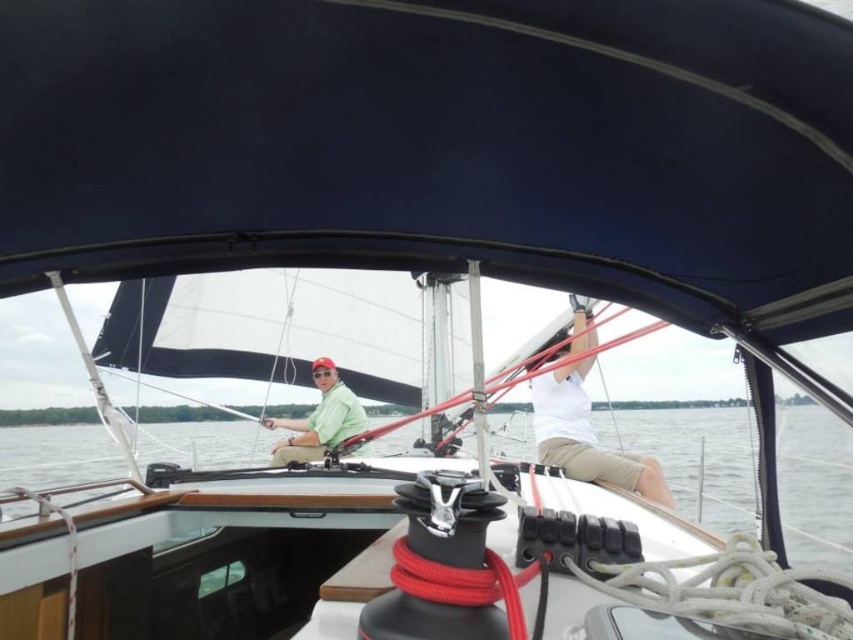
Who is lower down, clear water at center or matte green shirt at center?

Positioned lower is clear water at center.

Is clear water at center taller than matte green shirt at center?

Indeed, clear water at center has a greater height compared to matte green shirt at center.

At what (x,y) coordinates should I click in order to perform the action: click on clear water at center. Please return your answer as a coordinate pair (x, y). This screenshot has width=853, height=640. Looking at the image, I should click on (695, 458).

Describe the element at coordinates (582, 419) in the screenshot. This screenshot has height=640, width=853. I see `white matte shirt at center` at that location.

Does point (589, 424) come behind point (303, 454)?

No, it is in front of (303, 454).

Which is behind, point (567, 410) or point (276, 451)?

The point (276, 451) is behind.

Locate an element on the screen. Image resolution: width=853 pixels, height=640 pixels. white matte shirt at center is located at coordinates (582, 419).

Does point (3, 442) come behind point (631, 468)?

Yes, it is behind point (631, 468).

Based on the photo, is clear water at center to the right of white matte shirt at center from the viewer's perspective?

No, clear water at center is not to the right of white matte shirt at center.

Between point (695, 419) and point (540, 458), which one is positioned behind?

Positioned behind is point (695, 419).

Where is `clear water at center`? The width and height of the screenshot is (853, 640). clear water at center is located at coordinates (695, 458).